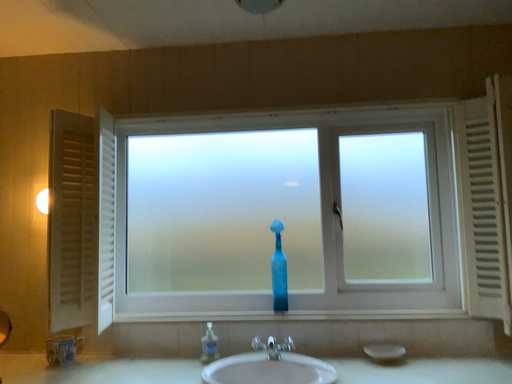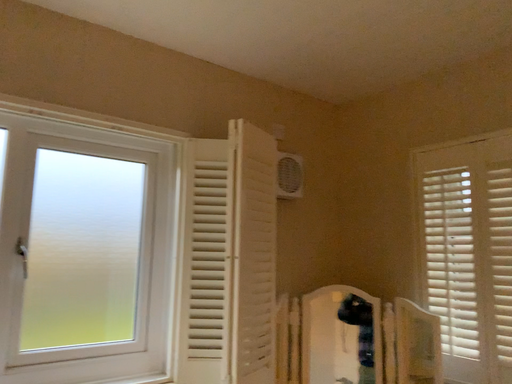
Question: How did the camera likely rotate when shooting the video?

Choices:
 (A) rotated right
 (B) rotated left

Answer: (A)